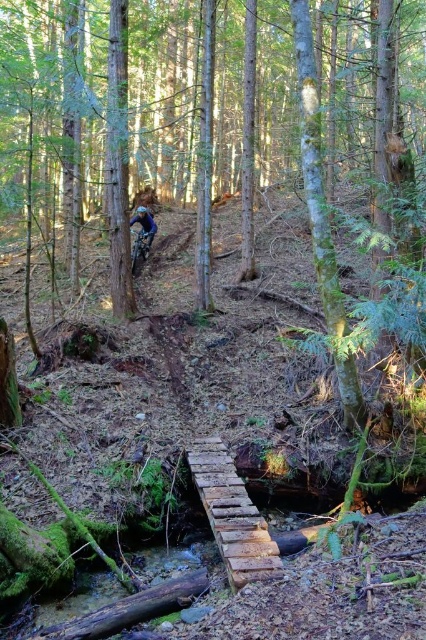
Question: In this image, where is shiny metallic mountain bike at center located relative to blue fabric helmet at upper center?

Choices:
 (A) right
 (B) left

Answer: (B)

Question: Which of the following is the closest to the observer?

Choices:
 (A) rustic wooden bridge at center
 (B) blue fabric helmet at upper center

Answer: (A)

Question: Which point is farther to the camera?

Choices:
 (A) tap(210, 474)
 (B) tap(135, 237)
 (C) tap(147, 216)

Answer: (C)

Question: Considering the real-world distances, which object is farthest from the shiny metallic mountain bike at center?

Choices:
 (A) rustic wooden bridge at center
 (B) blue fabric helmet at upper center

Answer: (A)

Question: Is rustic wooden bridge at center to the right of shiny metallic mountain bike at center from the viewer's perspective?

Choices:
 (A) yes
 (B) no

Answer: (A)

Question: Does shiny metallic mountain bike at center appear over blue fabric helmet at upper center?

Choices:
 (A) no
 (B) yes

Answer: (A)